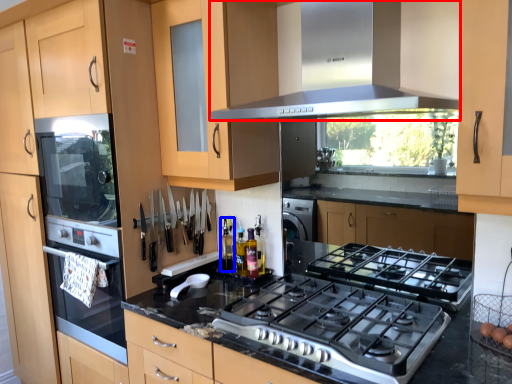
Question: Which object is closer to the camera taking this photo, home appliance (highlighted by a red box) or bottle (highlighted by a blue box)?

Choices:
 (A) home appliance
 (B) bottle

Answer: (A)